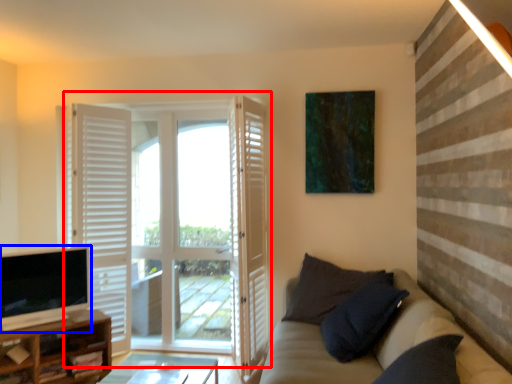
Question: Which object appears closest to the camera in this image, door (highlighted by a red box) or television (highlighted by a blue box)?

Choices:
 (A) door
 (B) television

Answer: (B)